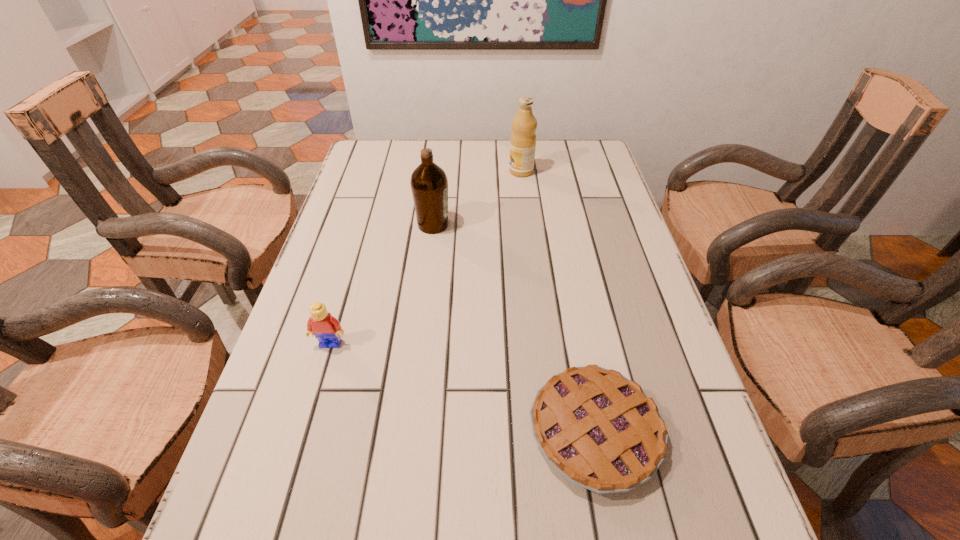
This screenshot has height=540, width=960. In the image, there is a desktop. Identify the location of free space at the far left corner. (397, 152).

Where is `free region at the far right corner`? The width and height of the screenshot is (960, 540). free region at the far right corner is located at coordinates (574, 156).

Identify the location of free space between the third nearest object and the pie. (514, 328).

The image size is (960, 540). Find the location of `vacant space that is in between the third farthest object and the second farthest object`. vacant space that is in between the third farthest object and the second farthest object is located at coordinates (382, 284).

Find the location of a particular element. The image size is (960, 540). unoccupied area between the left olive oil and the farthest object is located at coordinates (477, 198).

The height and width of the screenshot is (540, 960). I want to click on free area in between the second object from left to right and the leftmost object, so click(x=382, y=284).

Identify the location of unoccupied position between the left olive oil and the Lego. Image resolution: width=960 pixels, height=540 pixels. (382, 284).

I want to click on vacant area between the left olive oil and the pie, so click(x=514, y=328).

The width and height of the screenshot is (960, 540). Identify the location of free point between the shortest object and the second nearest object. (463, 388).

Identify the location of empty space between the farther olive oil and the third object from right to left. (477, 198).